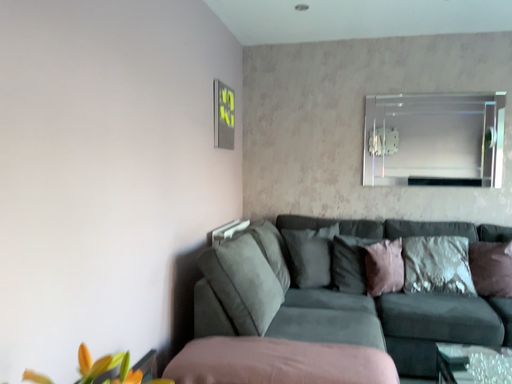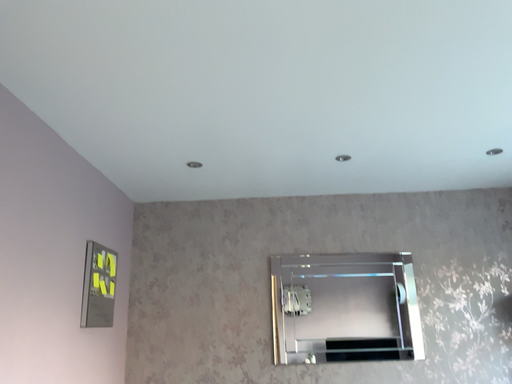
Question: Which way did the camera rotate in the video?

Choices:
 (A) rotated left
 (B) rotated right

Answer: (B)